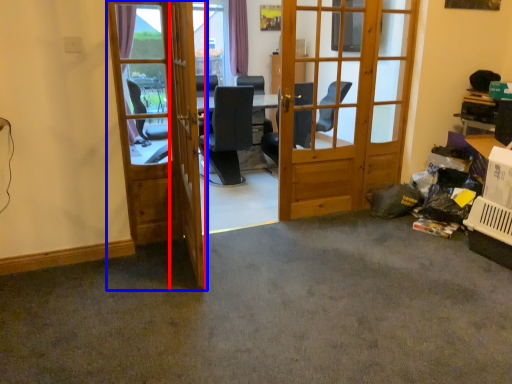
Question: Which object is closer to the camera taking this photo, screen door (highlighted by a red box) or door (highlighted by a blue box)?

Choices:
 (A) screen door
 (B) door

Answer: (A)